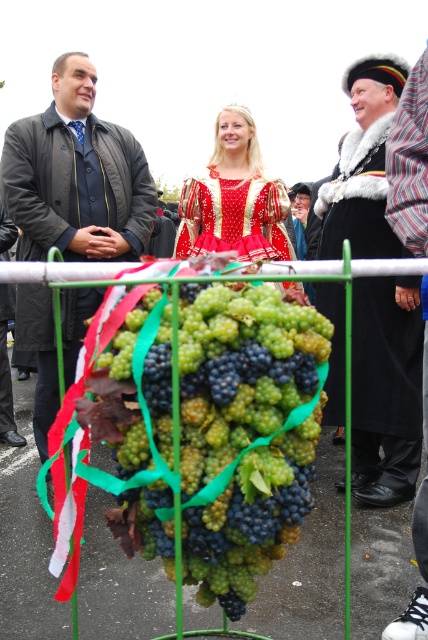
Question: Which point is farther to the camera?

Choices:
 (A) (386, 211)
 (B) (394, 326)
 (C) (44, 362)

Answer: (C)

Question: Considering the real-world distances, which object is farthest from the matte black coat at left?

Choices:
 (A) black velvet coat at center
 (B) striped shirt at right
 (C) shiny red dress at center

Answer: (B)

Question: Which point is farther to the camera?

Choices:
 (A) 125,336
 (B) 403,198
 (C) 56,234

Answer: (C)

Question: Can you confirm if green matte grapes at center is positioned to the left of shiny red dress at center?

Choices:
 (A) no
 (B) yes

Answer: (B)

Question: Can you confirm if green matte grapes at center is positioned below black velvet coat at center?

Choices:
 (A) no
 (B) yes

Answer: (B)

Question: Is green matte grapes at center behind matte black coat at left?

Choices:
 (A) yes
 (B) no

Answer: (B)